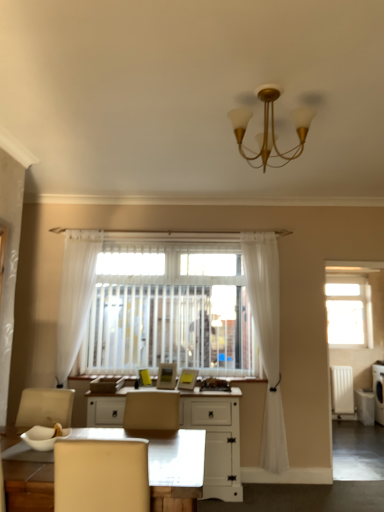
Identify the location of vacant area on top of white sheer curtain at left, the 1th curtain when ordered from left to right (from a real-world perspective). (84, 234).